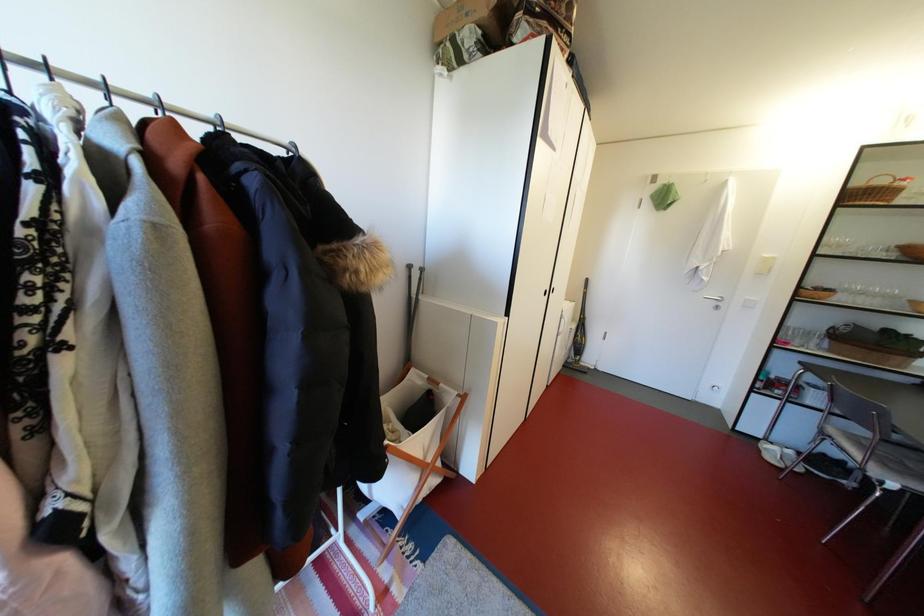
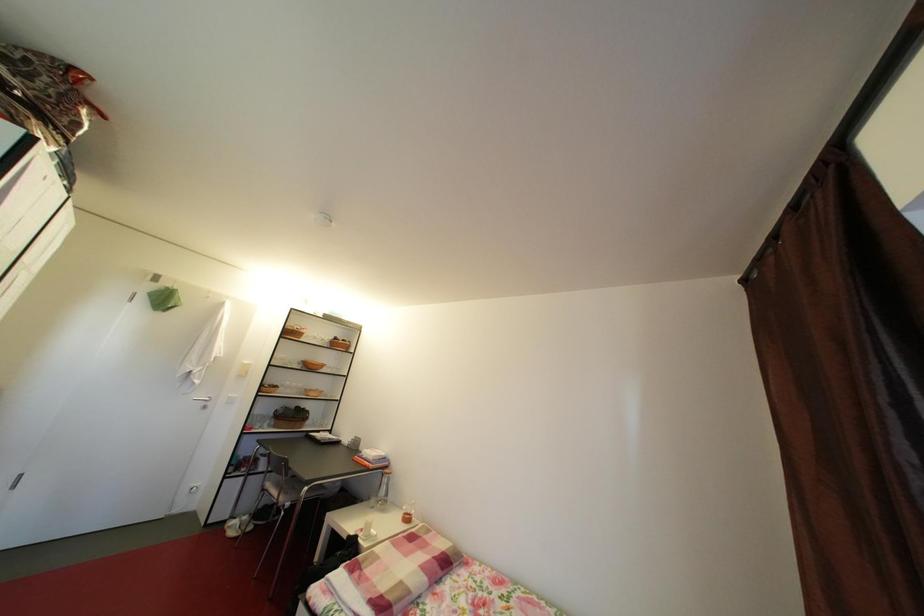
Question: The camera is either moving clockwise (left) or counter-clockwise (right) around the object. The first image is from the beginning of the video and the second image is from the end. Is the camera moving left or right when shooting the video?

Choices:
 (A) Left
 (B) Right

Answer: (A)